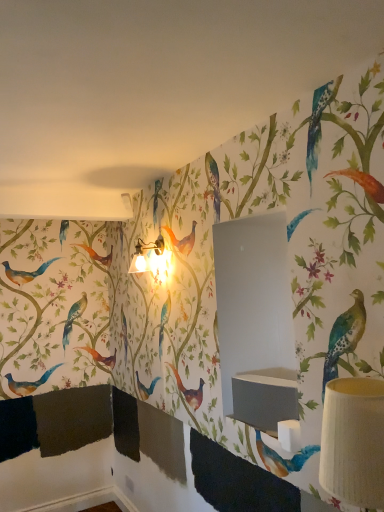
Question: Is metallic gold table lamp at upper center, which is the 1th table lamp in top-to-bottom order, inside the boundaries of white textured lampshade at right, which is the 2th table lamp from left to right, or outside?

Choices:
 (A) outside
 (B) inside

Answer: (A)

Question: Does point (139, 258) appear closer or farther from the camera than point (336, 490)?

Choices:
 (A) farther
 (B) closer

Answer: (A)

Question: Estimate the real-world distances between objects in this image. Which object is closer to the metallic gold table lamp at upper center, which appears as the second table lamp when ordered from the bottom?

Choices:
 (A) matte gray sink at center
 (B) white textured lampshade at right, which is the 2th table lamp from left to right

Answer: (A)

Question: Which is nearer to the matte gray sink at center?

Choices:
 (A) white textured lampshade at right, the 1th table lamp viewed from the right
 (B) metallic gold table lamp at upper center, which is the first table lamp in left-to-right order

Answer: (A)